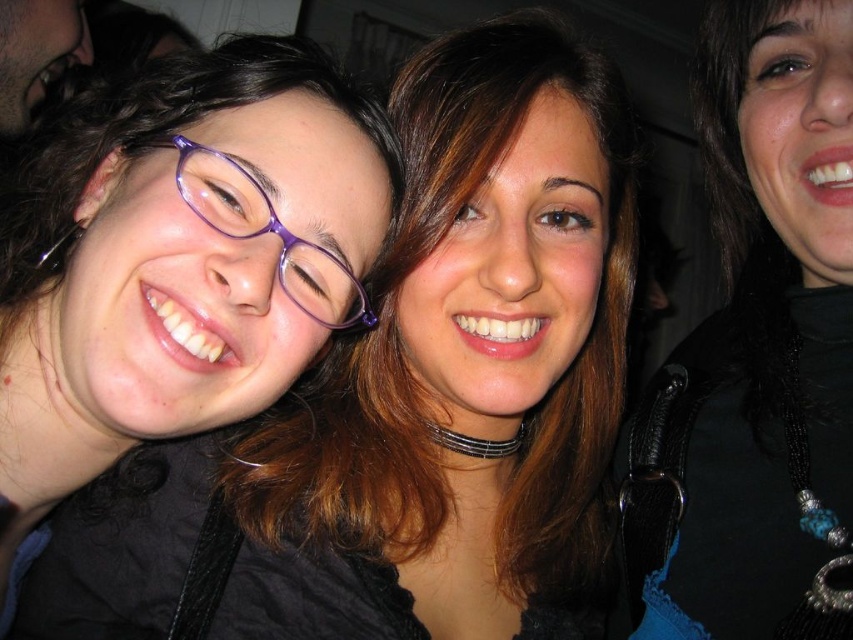
Question: Where is matte black jacket at center located in relation to black beaded necklace at upper right in the image?

Choices:
 (A) left
 (B) right

Answer: (A)

Question: Is matte black jacket at center below black beaded necklace at upper right?

Choices:
 (A) yes
 (B) no

Answer: (A)

Question: Among these objects, which one is nearest to the camera?

Choices:
 (A) black beaded necklace at upper right
 (B) matte black jacket at center

Answer: (A)

Question: Does matte black jacket at center have a larger size compared to black beaded necklace at upper right?

Choices:
 (A) no
 (B) yes

Answer: (B)